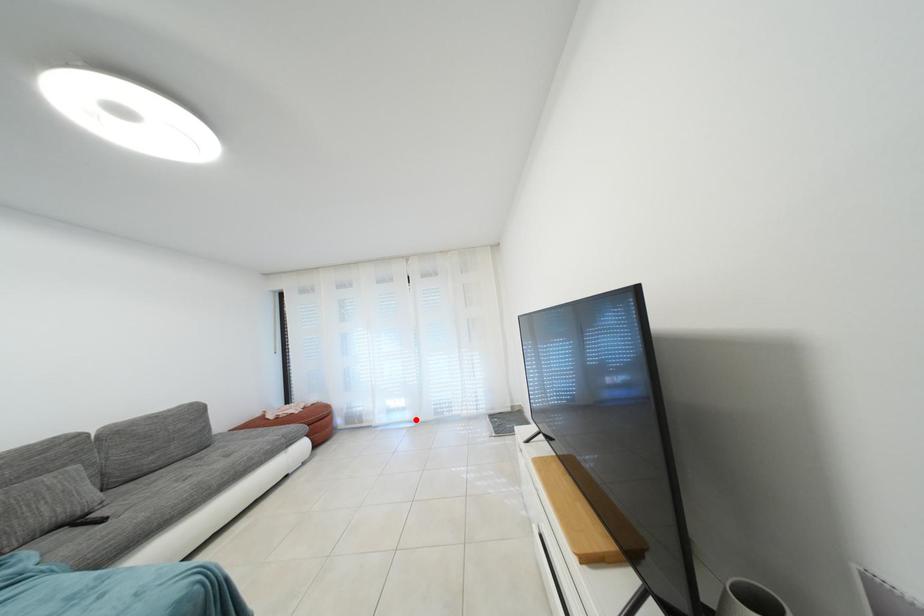
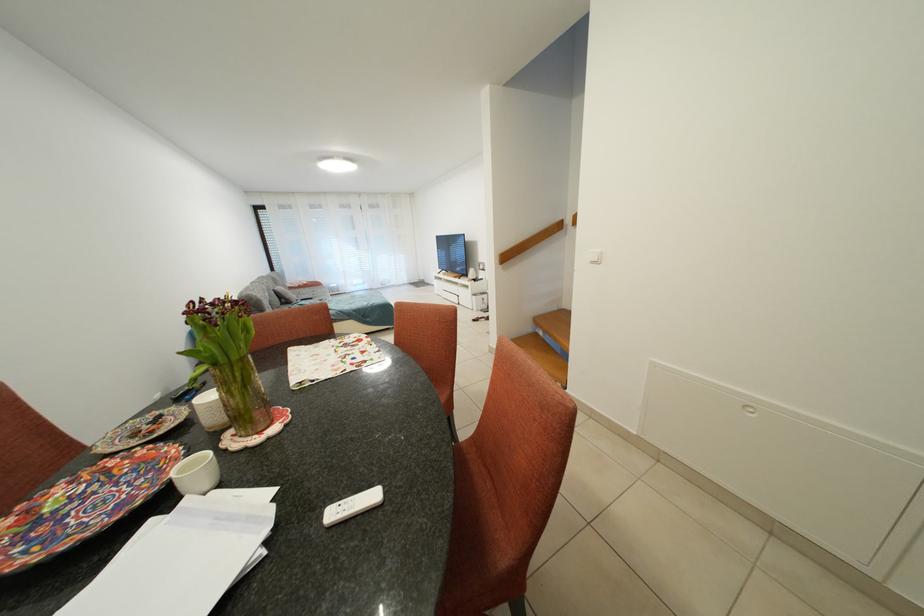
Question: I am providing you with two images of the same scene from different viewpoints. Image1 has a red point marked. In image2, the corresponding 3D location appears at what relative position? Reply with the corresponding letter.

Choices:
 (A) Closer
 (B) Farther

Answer: (A)